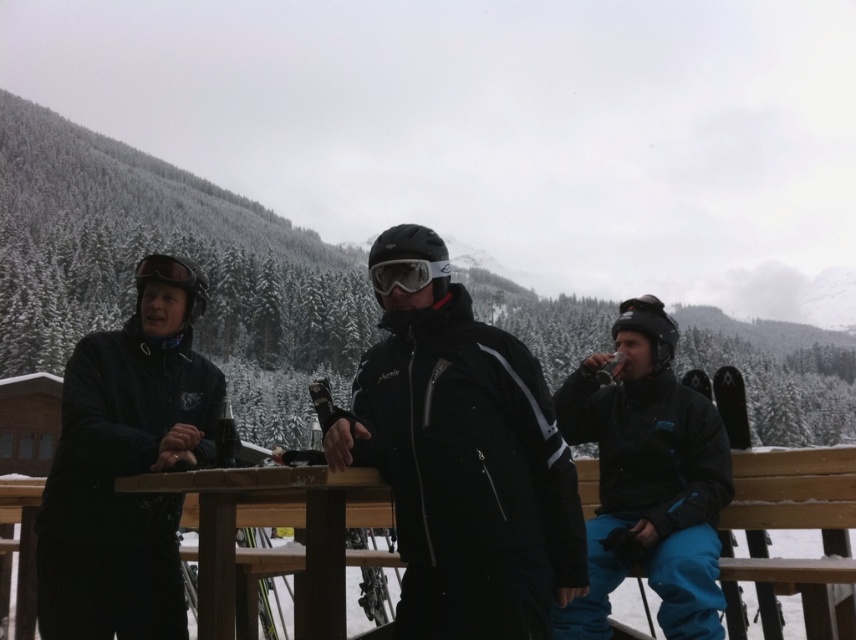
Consider the image. You are a photographer positioned at the origin point of the image coordinate system. You want to take a photo of the matte black jacket at center. What are the coordinates where you should aim your camera?

The coordinates to aim your camera are at point (465, 470) to capture the matte black jacket at center.

In the scene shown: You are standing at the origin point in the winter scene. There is a matte black jacket at right located at point (x=649, y=477). Can you tell me what direction the matte black jacket at right is relative to your position?

The matte black jacket at right is located at point (x=649, y=477), which is to the right of the origin point.